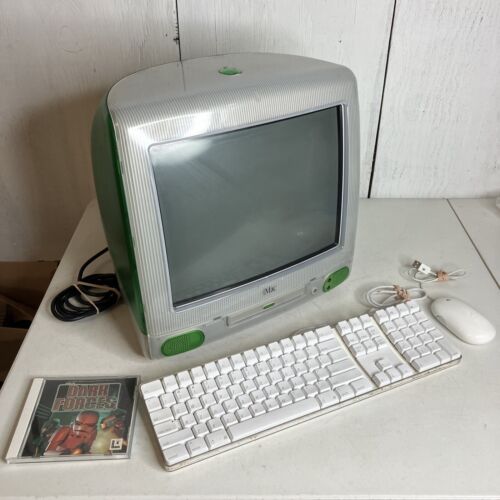
Where is `screen`? This screenshot has width=500, height=500. screen is located at coordinates (258, 205).